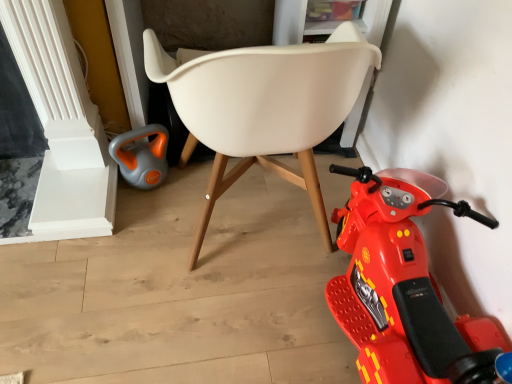
This screenshot has height=384, width=512. Identify the location of shiny plastic scooter at lower right. (403, 286).

Where is `white plastic chair at center`? Image resolution: width=512 pixels, height=384 pixels. white plastic chair at center is located at coordinates (263, 106).

Identify the location of shiny plastic scooter at lower right. The image size is (512, 384). (403, 286).

Can you tell me how much shiny plastic scooter at lower right and gray-orange plastic kettle at lower left differ in facing direction?

The facing directions of shiny plastic scooter at lower right and gray-orange plastic kettle at lower left are 101 degrees apart.

Which is more distant, (374, 353) or (152, 159)?

The point (152, 159) is more distant.

From a real-world perspective, is shiny plastic scooter at lower right located higher than gray-orange plastic kettle at lower left?

Yes.

From the image's perspective, between shiny plastic scooter at lower right and gray-orange plastic kettle at lower left, who is located below?

shiny plastic scooter at lower right is shown below in the image.

Is gray-orange plastic kettle at lower left positioned before white plastic chair at center?

No.

The width and height of the screenshot is (512, 384). I want to click on chair that appears above the gray-orange plastic kettle at lower left (from a real-world perspective), so click(263, 106).

Is point (155, 126) closer or farther from the camera than point (185, 69)?

Point (155, 126) appears to be farther away from the viewer than point (185, 69).

Is there a large distance between gray-orange plastic kettle at lower left and white plastic chair at center?

No, gray-orange plastic kettle at lower left is not far from white plastic chair at center.

Between point (206, 102) and point (156, 156), which one is positioned in front?

The point (206, 102) is closer to the camera.

Is white plastic chair at center aimed at gray-orange plastic kettle at lower left?

No, white plastic chair at center is not oriented towards gray-orange plastic kettle at lower left.

Between white plastic chair at center and gray-orange plastic kettle at lower left, which one has larger width?

white plastic chair at center is wider.

In the image, is white plastic chair at center positioned in front of or behind gray-orange plastic kettle at lower left?

In the image, white plastic chair at center appears in front of gray-orange plastic kettle at lower left.

Are shiny plastic scooter at lower right and white plastic chair at center beside each other?

No, shiny plastic scooter at lower right is not making contact with white plastic chair at center.

Does shiny plastic scooter at lower right have a larger size compared to white plastic chair at center?

Actually, shiny plastic scooter at lower right might be smaller than white plastic chair at center.

Considering the sizes of shiny plastic scooter at lower right and white plastic chair at center in the image, is shiny plastic scooter at lower right taller or shorter than white plastic chair at center?

Clearly, shiny plastic scooter at lower right is shorter compared to white plastic chair at center.

Is gray-orange plastic kettle at lower left located outside shiny plastic scooter at lower right?

gray-orange plastic kettle at lower left lies outside shiny plastic scooter at lower right's area.

Could you tell me if gray-orange plastic kettle at lower left is turned towards shiny plastic scooter at lower right?

No.

Can you confirm if gray-orange plastic kettle at lower left is bigger than shiny plastic scooter at lower right?

Incorrect, gray-orange plastic kettle at lower left is not larger than shiny plastic scooter at lower right.

Which is behind, gray-orange plastic kettle at lower left or shiny plastic scooter at lower right?

gray-orange plastic kettle at lower left.

Considering the relative sizes of white plastic chair at center and shiny plastic scooter at lower right in the image provided, is white plastic chair at center bigger than shiny plastic scooter at lower right?

Correct, white plastic chair at center is larger in size than shiny plastic scooter at lower right.

How distant is white plastic chair at center from shiny plastic scooter at lower right?

white plastic chair at center and shiny plastic scooter at lower right are 13.17 inches apart.

Is there a large distance between white plastic chair at center and shiny plastic scooter at lower right?

white plastic chair at center is near shiny plastic scooter at lower right, not far away.

Locate an element on the screen. The width and height of the screenshot is (512, 384). chair that is in front of the shiny plastic scooter at lower right is located at coordinates (263, 106).

Find the location of a particular element. The width and height of the screenshot is (512, 384). toy lying on the left of shiny plastic scooter at lower right is located at coordinates (142, 156).

In the image, there is a white plastic chair at center. Find the location of `toy below it (from the image's perspective)`. toy below it (from the image's perspective) is located at coordinates (142, 156).

Considering their positions, is white plastic chair at center positioned closer to shiny plastic scooter at lower right than gray-orange plastic kettle at lower left?

Among the two, white plastic chair at center is located nearer to shiny plastic scooter at lower right.

Looking at the image, which one is located closer to gray-orange plastic kettle at lower left, white plastic chair at center or shiny plastic scooter at lower right?

white plastic chair at center is positioned closer to the anchor gray-orange plastic kettle at lower left.

From the image, which object appears to be farther from shiny plastic scooter at lower right, gray-orange plastic kettle at lower left or white plastic chair at center?

gray-orange plastic kettle at lower left is positioned further to the anchor shiny plastic scooter at lower right.

Which object lies nearer to the anchor point gray-orange plastic kettle at lower left, shiny plastic scooter at lower right or white plastic chair at center?

white plastic chair at center.

Considering their positions, is shiny plastic scooter at lower right positioned further to white plastic chair at center than gray-orange plastic kettle at lower left?

The object further to white plastic chair at center is gray-orange plastic kettle at lower left.

From the image, which object appears to be farther from white plastic chair at center, gray-orange plastic kettle at lower left or shiny plastic scooter at lower right?

Based on the image, gray-orange plastic kettle at lower left appears to be further to white plastic chair at center.

Locate an element on the screen. chair between gray-orange plastic kettle at lower left and shiny plastic scooter at lower right from left to right is located at coordinates (263, 106).